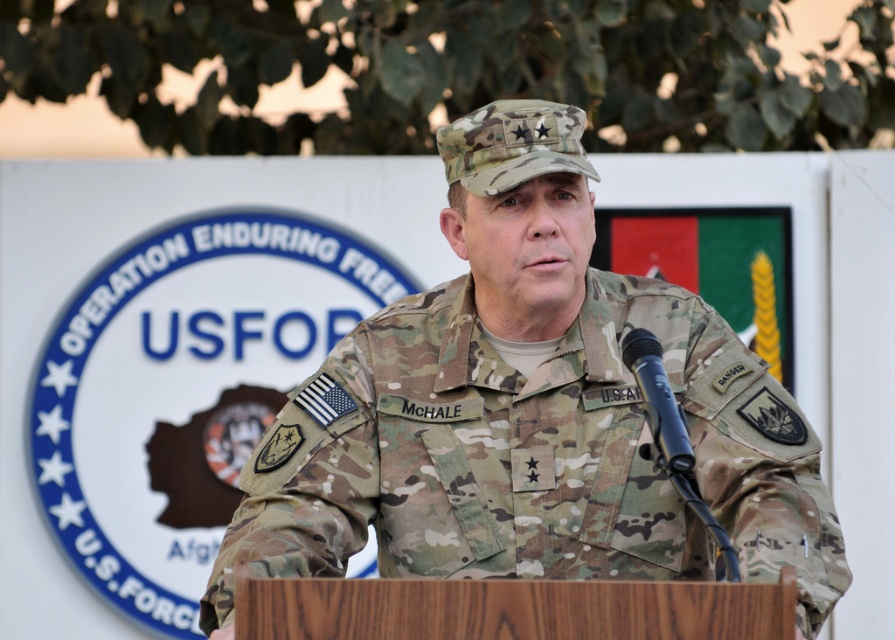
Based on the photo, who is more forward, (533, 168) or (652, 420)?

Positioned in front is point (652, 420).

Is camo uniform at center taller than black matte microphone at center?

Indeed, camo uniform at center has a greater height compared to black matte microphone at center.

Which is behind, point (544, 100) or point (678, 474)?

The point (544, 100) is more distant.

Image resolution: width=895 pixels, height=640 pixels. Find the location of `camo uniform at center`. camo uniform at center is located at coordinates (529, 412).